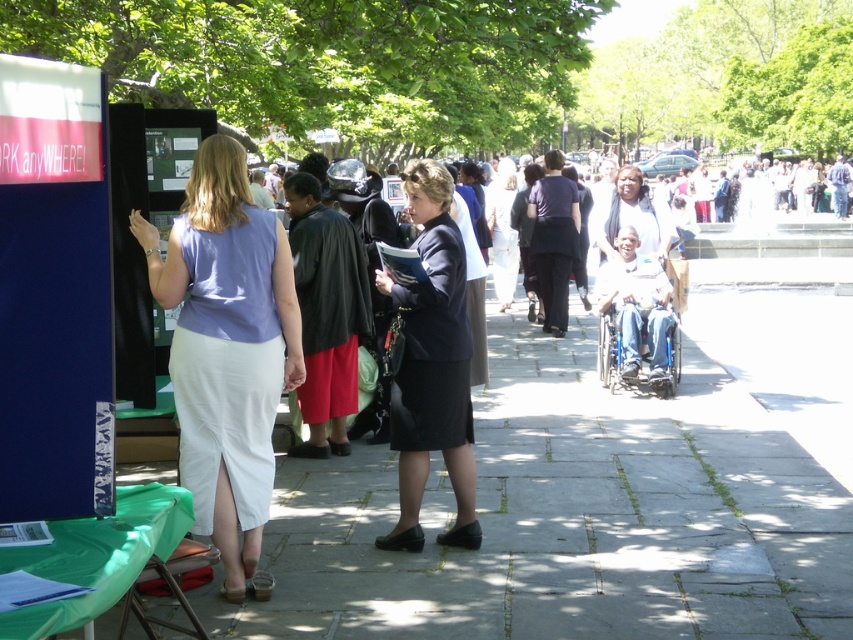
Can you confirm if matte purple blouse at center is smaller than white cotton shirt at center?

Correct, matte purple blouse at center occupies less space than white cotton shirt at center.

What are the coordinates of `matte purple blouse at center` in the screenshot? It's located at (227, 352).

Can you confirm if matte purple blouse at center is positioned to the right of black fabric skirt at center?

In fact, matte purple blouse at center is to the left of black fabric skirt at center.

Which is in front, point (186, 422) or point (424, 300)?

Point (186, 422)

Between point (222, 298) and point (421, 460), which one is positioned in front?

Point (222, 298) is more forward.

Find the location of a particular element. matte purple blouse at center is located at coordinates (227, 352).

Does black fabric skirt at center have a lesser height compared to white cotton shirt at center?

Indeed, black fabric skirt at center has a lesser height compared to white cotton shirt at center.

Looking at this image, which of these two, black fabric skirt at center or white cotton shirt at center, stands taller?

white cotton shirt at center is taller.

The height and width of the screenshot is (640, 853). I want to click on black fabric skirt at center, so click(432, 365).

What are the coordinates of `black fabric skirt at center` in the screenshot? It's located at (432, 365).